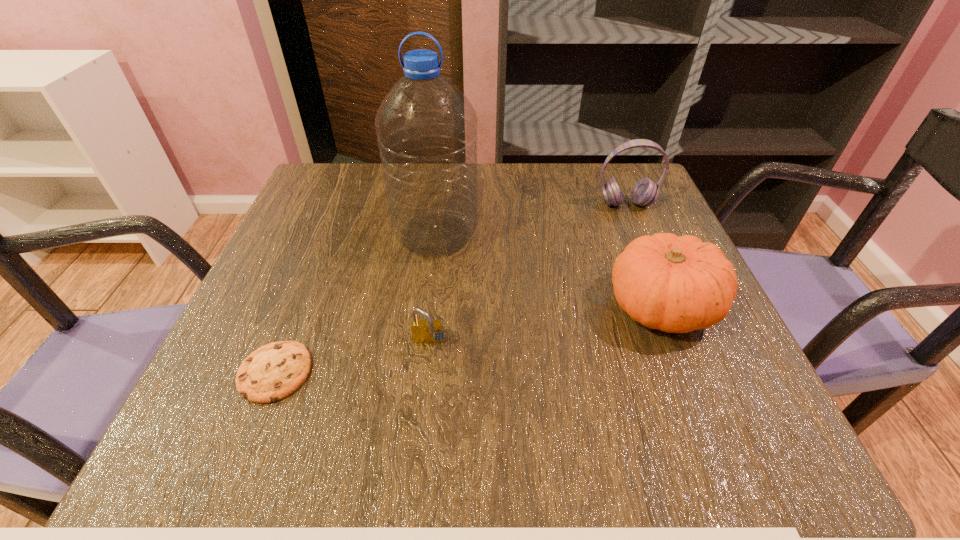
You are a GUI agent. You are given a task and a screenshot of the screen. Output one action in this format:
    pyautogui.click(x=<x>, y=<y>)
    Task: Click on the vacant space at the near left corner of the desktop
    
    Given the screenshot: What is the action you would take?
    pyautogui.click(x=235, y=427)

Where is `free space at the far right corner of the desktop`? This screenshot has width=960, height=540. free space at the far right corner of the desktop is located at coordinates (606, 217).

Image resolution: width=960 pixels, height=540 pixels. In the image, there is a desktop. Find the location of `vacant space at the near right corner`. vacant space at the near right corner is located at coordinates (743, 431).

What are the coordinates of `free point between the pumpkin and the shortest object` in the screenshot? It's located at (468, 339).

You are a GUI agent. You are given a task and a screenshot of the screen. Output one action in this format:
    pyautogui.click(x=<x>, y=<y>)
    Task: Click on the free space between the water jug and the fourth shortest object
    The height and width of the screenshot is (540, 960).
    Given the screenshot: What is the action you would take?
    pyautogui.click(x=531, y=219)

In order to click on free space that is in between the water jug and the cookie in this screenshot , I will do `click(355, 303)`.

You are a GUI agent. You are given a task and a screenshot of the screen. Output one action in this format:
    pyautogui.click(x=<x>, y=<y>)
    Task: Click on the empty location between the water jug and the pumpkin
    This screenshot has height=540, width=960.
    Given the screenshot: What is the action you would take?
    pyautogui.click(x=548, y=271)

What are the coordinates of `unoccupied position between the cookie and the tallest object` in the screenshot? It's located at (355, 303).

Image resolution: width=960 pixels, height=540 pixels. I want to click on free space between the second shortest object and the fourth shortest object, so click(527, 274).

This screenshot has height=540, width=960. Find the location of `vacant space that's between the pumpkin and the water jug`. vacant space that's between the pumpkin and the water jug is located at coordinates (548, 271).